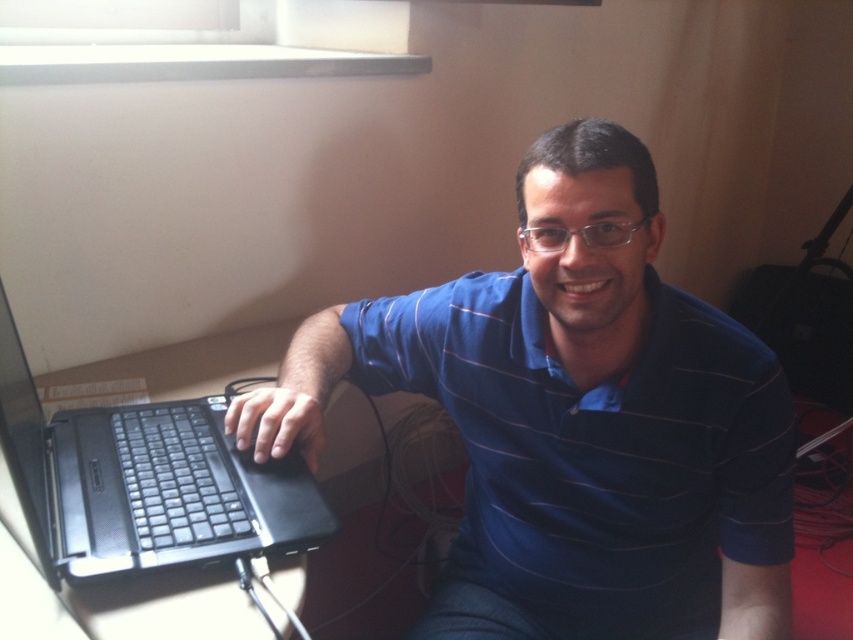
Question: Where is blue striped shirt at center located in relation to black matte laptop at lower left in the image?

Choices:
 (A) below
 (B) above

Answer: (B)

Question: Does blue striped shirt at center have a smaller size compared to black matte laptop at lower left?

Choices:
 (A) yes
 (B) no

Answer: (B)

Question: Which of the following is the closest to the observer?

Choices:
 (A) blue striped shirt at center
 (B) black matte laptop at lower left

Answer: (B)

Question: Considering the relative positions of blue striped shirt at center and black matte laptop at lower left in the image provided, where is blue striped shirt at center located with respect to black matte laptop at lower left?

Choices:
 (A) right
 (B) left

Answer: (A)

Question: Which point appears farthest from the camera in this image?

Choices:
 (A) (666, 356)
 (B) (19, 493)

Answer: (A)